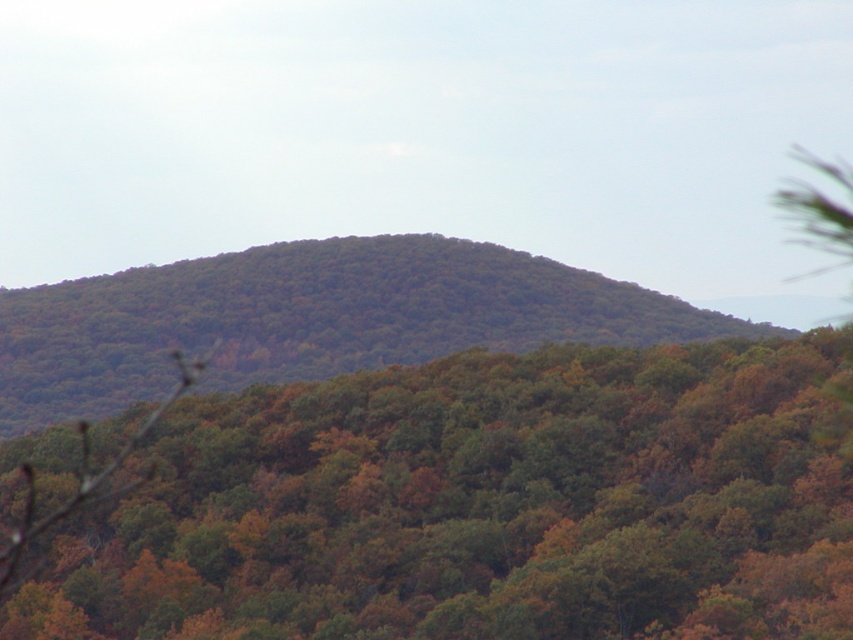
You are an environmental scientist observing the image. You notice two distinct forest areas labeled as the green matte forest at center and the green leafy forest at center. Based on their appearance, which forest area is shorter in height?

The green matte forest at center is not as tall as the green leafy forest at center, so the green matte forest at center is shorter in height.

You are standing in the forest and want to take a photo. You notice two points in the scene labeled as point [398,444] and point [184,323]. Which point is closer to your camera lens?

Point [398,444] is closer to the camera than point [184,323].

You are an environmental scientist examining the image of a forest landscape. You notice two distinct areas labeled as the green matte forest at center and the green leafy forest at center. Based on their positions in the scene, which one is closer to you?

The green matte forest at center is closer to you because it is positioned in front of the green leafy forest at center.